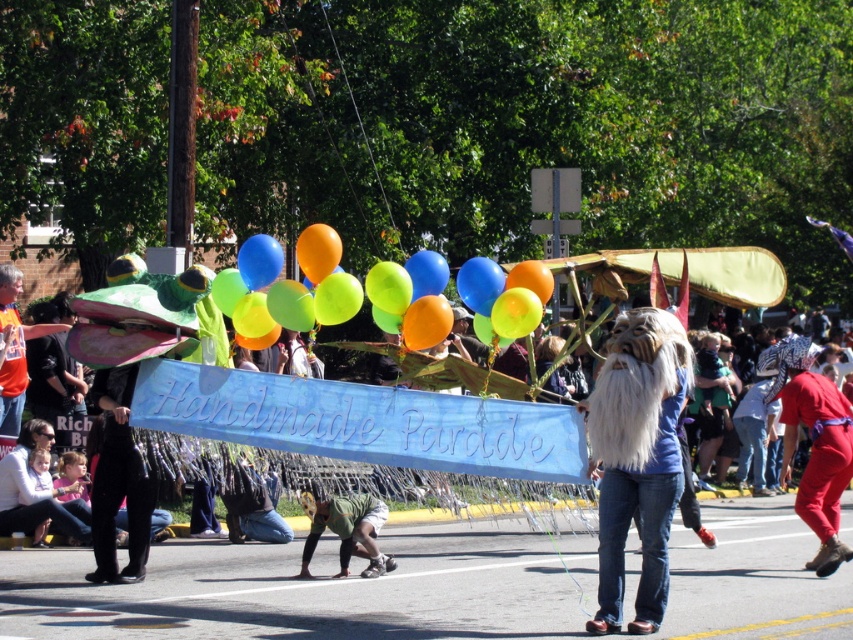
Who is positioned more to the right, handmade parade banner at center or orange t-shirt at left?

handmade parade banner at center

Image resolution: width=853 pixels, height=640 pixels. I want to click on handmade parade banner at center, so click(x=335, y=566).

Does handmade parade banner at center appear on the left side of blue rubber balloon at center?

Incorrect, handmade parade banner at center is not on the left side of blue rubber balloon at center.

Find the location of a particular element. This screenshot has width=853, height=640. handmade parade banner at center is located at coordinates (335, 566).

Where is `handmade parade banner at center`? handmade parade banner at center is located at coordinates (335, 566).

Between white fluffy beard at center and green matte shorts at lower center, which one has less height?

With less height is green matte shorts at lower center.

Between point (605, 566) and point (383, 509), which one is positioned behind?

Positioned behind is point (383, 509).

The width and height of the screenshot is (853, 640). I want to click on white fluffy beard at center, so [x=637, y=458].